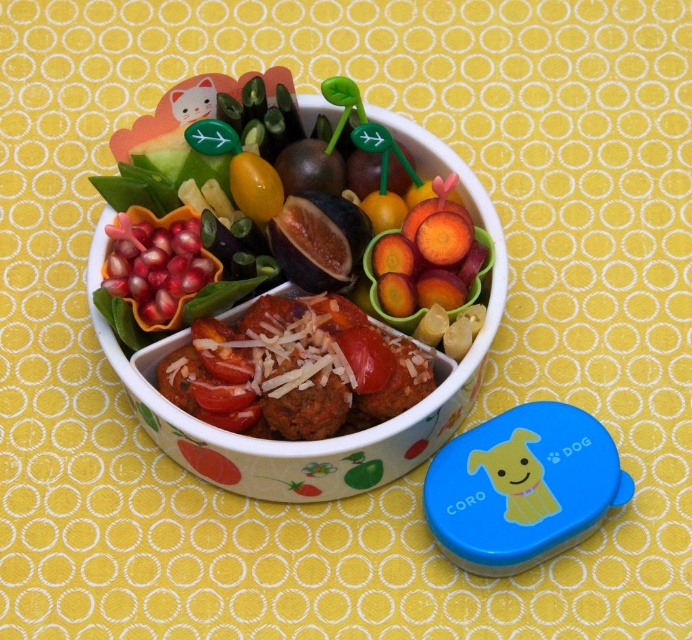
Does point (95, 275) lie in front of point (304, 388)?

No, (95, 275) is further to viewer.

Does white glossy bowl at center have a lesser height compared to brown matte meatballs at center?

No, white glossy bowl at center is not shorter than brown matte meatballs at center.

Who is more distant from viewer, (400, 138) or (275, 436)?

The point (400, 138) is more distant.

What are the coordinates of `white glossy bowl at center` in the screenshot? It's located at (327, 438).

Can you confirm if smooth orange carrot at center is wider than pomegranate seeds at center?

Correct, the width of smooth orange carrot at center exceeds that of pomegranate seeds at center.

Between point (424, 284) and point (109, 266), which one is positioned behind?

The point (424, 284) is behind.

I want to click on smooth orange carrot at center, so click(x=426, y=259).

Is blue plastic lid at lower right taller than smooth orange carrot at center?

Yes.

Is blue plastic lid at lower right below smooth orange carrot at center?

Yes.

Is point (518, 538) more distant than point (453, 221)?

No, it is not.

Find the location of a particular element. blue plastic lid at lower right is located at coordinates (522, 486).